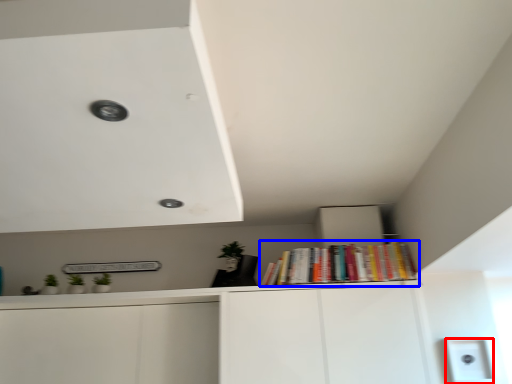
Question: Which object is further to the camera taking this photo, light switch (highlighted by a red box) or book (highlighted by a blue box)?

Choices:
 (A) light switch
 (B) book

Answer: (B)